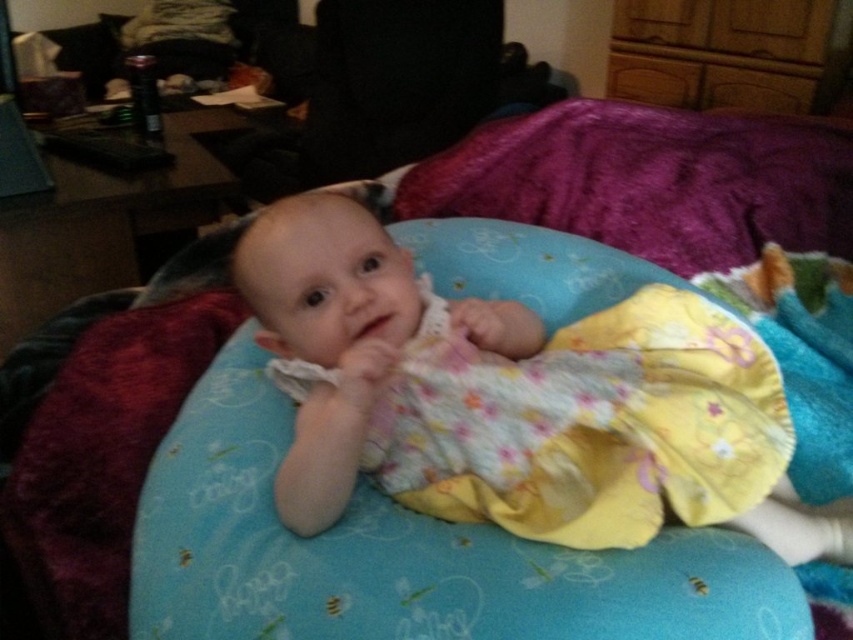
Question: Is yellow floral dress at center wider than purple plush blanket at upper center?

Choices:
 (A) no
 (B) yes

Answer: (A)

Question: From the image, what is the correct spatial relationship of yellow floral dress at center in relation to purple plush blanket at upper center?

Choices:
 (A) below
 (B) above

Answer: (A)

Question: Which point appears closest to the camera in this image?

Choices:
 (A) (822, 524)
 (B) (457, 156)

Answer: (A)

Question: Which object is farther from the camera taking this photo?

Choices:
 (A) yellow floral dress at center
 (B) purple plush blanket at upper center

Answer: (B)

Question: Which object appears closest to the camera in this image?

Choices:
 (A) purple plush blanket at upper center
 (B) yellow floral dress at center

Answer: (B)

Question: Is yellow floral dress at center to the right of purple plush blanket at upper center from the viewer's perspective?

Choices:
 (A) yes
 (B) no

Answer: (B)